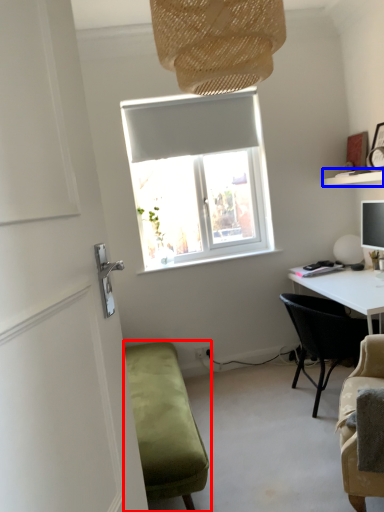
Question: Which object is closer to the camera taking this photo, studio couch (highlighted by a red box) or shelf (highlighted by a blue box)?

Choices:
 (A) studio couch
 (B) shelf

Answer: (A)